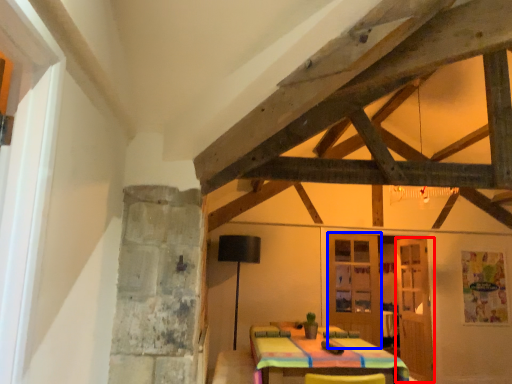
Question: Which object appears farthest to the camera in this image, door (highlighted by a red box) or door (highlighted by a blue box)?

Choices:
 (A) door
 (B) door

Answer: (A)